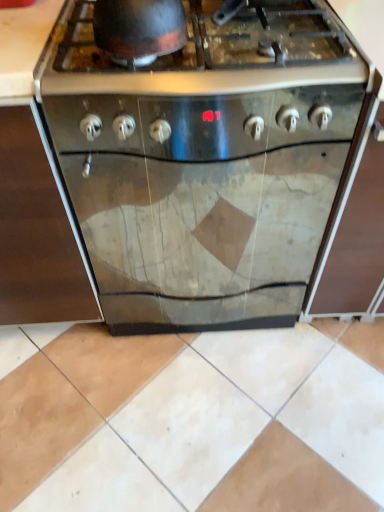
Question: Does stainless steel oven at left have a greater height compared to stainless steel gas stove at center?

Choices:
 (A) no
 (B) yes

Answer: (B)

Question: Is stainless steel oven at left surrounding stainless steel gas stove at center?

Choices:
 (A) yes
 (B) no

Answer: (B)

Question: Is stainless steel oven at left at the left side of stainless steel gas stove at center?

Choices:
 (A) yes
 (B) no

Answer: (A)

Question: Is stainless steel oven at left oriented towards stainless steel gas stove at center?

Choices:
 (A) no
 (B) yes

Answer: (A)

Question: Does stainless steel oven at left lie behind stainless steel gas stove at center?

Choices:
 (A) yes
 (B) no

Answer: (B)

Question: Considering the relative sizes of stainless steel oven at left and stainless steel gas stove at center in the image provided, is stainless steel oven at left bigger than stainless steel gas stove at center?

Choices:
 (A) yes
 (B) no

Answer: (A)

Question: Is stainless steel oven at left to the right of stainless steel oven at center from the viewer's perspective?

Choices:
 (A) yes
 (B) no

Answer: (B)

Question: Is stainless steel oven at left positioned before stainless steel oven at center?

Choices:
 (A) yes
 (B) no

Answer: (A)

Question: From a real-world perspective, is stainless steel oven at left physically below stainless steel oven at center?

Choices:
 (A) no
 (B) yes

Answer: (A)

Question: Does stainless steel oven at left have a greater height compared to stainless steel oven at center?

Choices:
 (A) yes
 (B) no

Answer: (A)

Question: Can you see stainless steel oven at left touching stainless steel oven at center?

Choices:
 (A) no
 (B) yes

Answer: (A)

Question: Would you say stainless steel oven at left is a long distance from stainless steel oven at center?

Choices:
 (A) yes
 (B) no

Answer: (B)

Question: Does shiny black wok at upper center appear on the left side of stainless steel oven at center?

Choices:
 (A) no
 (B) yes

Answer: (B)